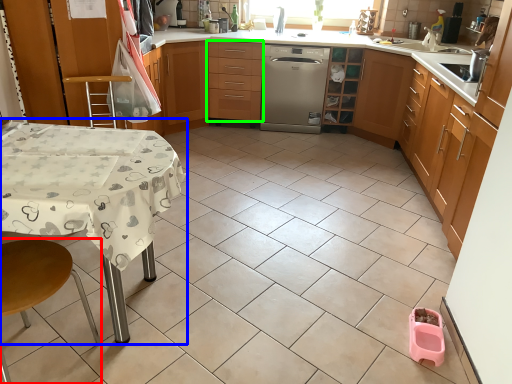
Question: Considering the real-world distances, which object is closest to step stool (highlighted by a red box)? table (highlighted by a blue box) or drawer (highlighted by a green box).

Choices:
 (A) table
 (B) drawer

Answer: (A)